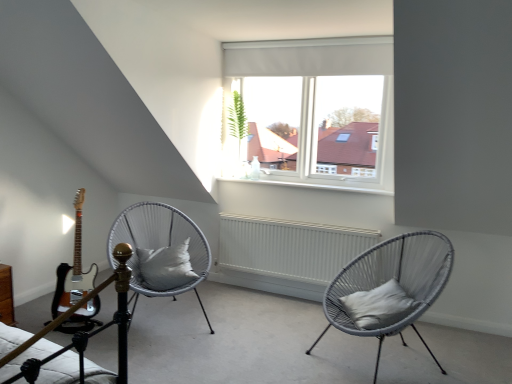
Where is `vacant point to the right of white woven chair at center, placed as the 1th chair when sorted from left to right`? Image resolution: width=512 pixels, height=384 pixels. vacant point to the right of white woven chair at center, placed as the 1th chair when sorted from left to right is located at coordinates (252, 338).